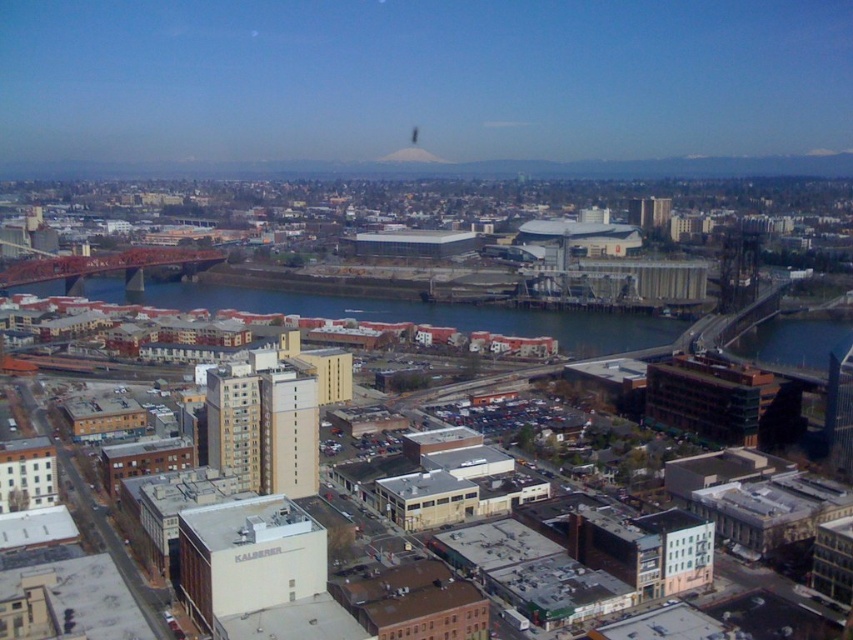
What are the coordinates of the smooth gray mountain at upper center in the image?

The smooth gray mountain at upper center is located at coordinates point (412, 154).